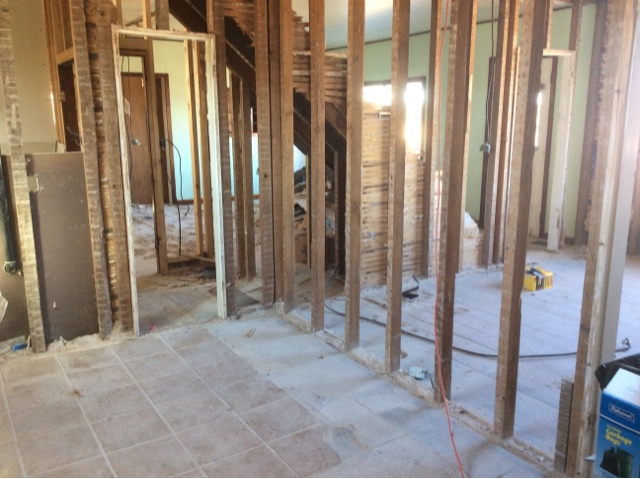
The height and width of the screenshot is (479, 640). In order to click on electrical wiring in this screenshot , I will do `click(180, 158)`, `click(129, 87)`, `click(470, 352)`, `click(180, 246)`.